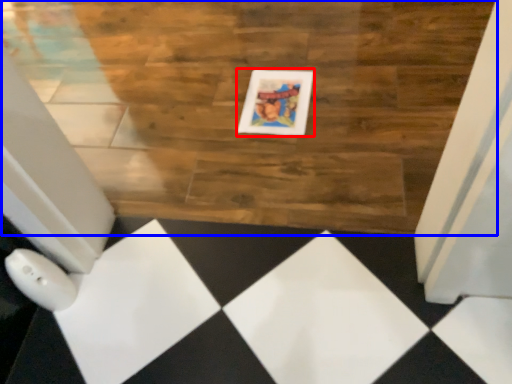
Question: Which of the following is the farthest to the observer, picture frame (highlighted by a red box) or hardwood (highlighted by a blue box)?

Choices:
 (A) picture frame
 (B) hardwood

Answer: (A)